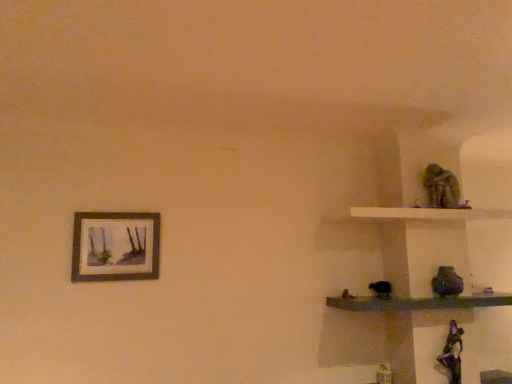
Question: Is green mossy statue at upper right bigger than white matte shelf at upper right, which ranks as the second shelf in bottom-to-top order?

Choices:
 (A) no
 (B) yes

Answer: (A)

Question: From the image's perspective, is green mossy statue at upper right above white matte shelf at upper right, which ranks as the second shelf in bottom-to-top order?

Choices:
 (A) yes
 (B) no

Answer: (A)

Question: Is green mossy statue at upper right wider than white matte shelf at upper right, which appears as the 1th shelf when viewed from the top?

Choices:
 (A) no
 (B) yes

Answer: (A)

Question: From the image's perspective, is green mossy statue at upper right under white matte shelf at upper right, which ranks as the second shelf in bottom-to-top order?

Choices:
 (A) no
 (B) yes

Answer: (A)

Question: Does green mossy statue at upper right have a smaller size compared to white matte shelf at upper right, which ranks as the second shelf in bottom-to-top order?

Choices:
 (A) no
 (B) yes

Answer: (B)

Question: Considering the positions of smooth dark wood shelf at right, the second shelf when ordered from top to bottom, and matte wooden picture frame at upper left in the image, is smooth dark wood shelf at right, the second shelf when ordered from top to bottom, taller or shorter than matte wooden picture frame at upper left?

Choices:
 (A) short
 (B) tall

Answer: (A)

Question: From the image's perspective, is smooth dark wood shelf at right, the second shelf when ordered from top to bottom, located above or below matte wooden picture frame at upper left?

Choices:
 (A) above
 (B) below

Answer: (B)

Question: Considering the relative positions of smooth dark wood shelf at right, the second shelf when ordered from top to bottom, and matte wooden picture frame at upper left in the image provided, is smooth dark wood shelf at right, the second shelf when ordered from top to bottom, to the left or to the right of matte wooden picture frame at upper left?

Choices:
 (A) left
 (B) right

Answer: (B)

Question: From a real-world perspective, is smooth dark wood shelf at right, placed as the 1th shelf when sorted from bottom to top, positioned above or below matte wooden picture frame at upper left?

Choices:
 (A) above
 (B) below

Answer: (B)

Question: Does point (351, 208) appear closer or farther from the camera than point (92, 268)?

Choices:
 (A) farther
 (B) closer

Answer: (A)

Question: Is white matte shelf at upper right, which appears as the 1th shelf when viewed from the top, in front of or behind matte wooden picture frame at upper left in the image?

Choices:
 (A) behind
 (B) front

Answer: (A)

Question: Considering the positions of white matte shelf at upper right, which ranks as the second shelf in bottom-to-top order, and matte wooden picture frame at upper left in the image, is white matte shelf at upper right, which ranks as the second shelf in bottom-to-top order, taller or shorter than matte wooden picture frame at upper left?

Choices:
 (A) tall
 (B) short

Answer: (B)

Question: Is white matte shelf at upper right, which ranks as the second shelf in bottom-to-top order, wider or thinner than matte wooden picture frame at upper left?

Choices:
 (A) wide
 (B) thin

Answer: (A)

Question: From a real-world perspective, is smooth dark wood shelf at right, the second shelf when ordered from top to bottom, physically located above or below green mossy statue at upper right?

Choices:
 (A) below
 (B) above

Answer: (A)

Question: Considering the positions of smooth dark wood shelf at right, the second shelf when ordered from top to bottom, and green mossy statue at upper right in the image, is smooth dark wood shelf at right, the second shelf when ordered from top to bottom, wider or thinner than green mossy statue at upper right?

Choices:
 (A) wide
 (B) thin

Answer: (A)